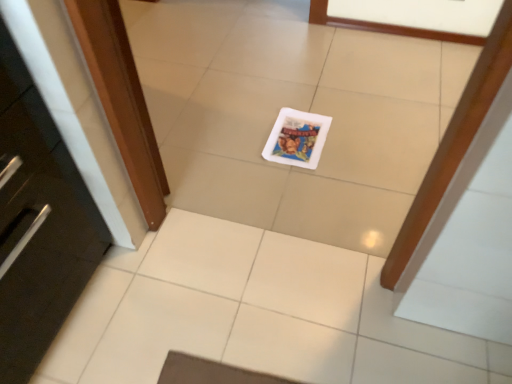
You are a GUI agent. You are given a task and a screenshot of the screen. Output one action in this format:
    pyautogui.click(x=<x>, y=<y>)
    Task: Click on the free space behind white matte postcard at center
    
    Given the screenshot: What is the action you would take?
    pyautogui.click(x=294, y=94)